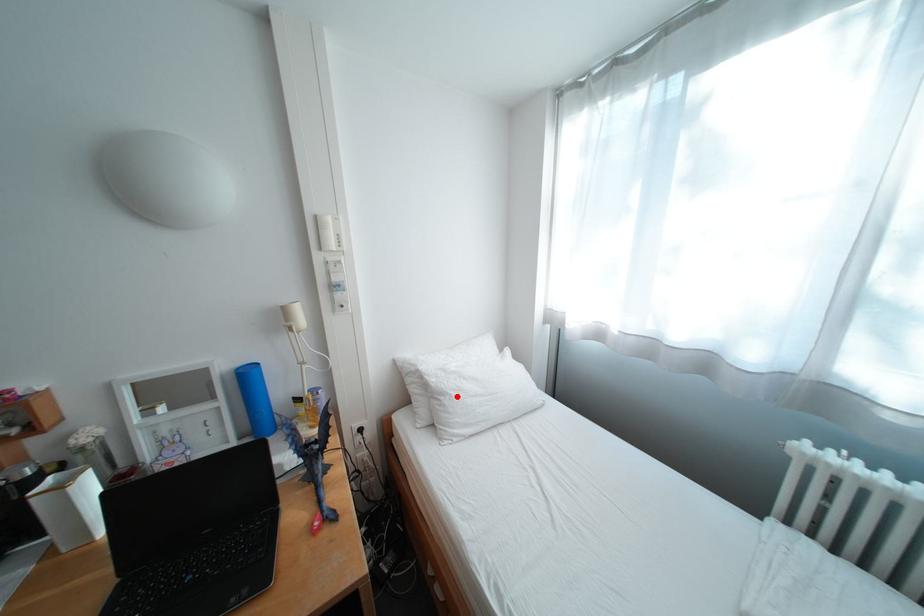
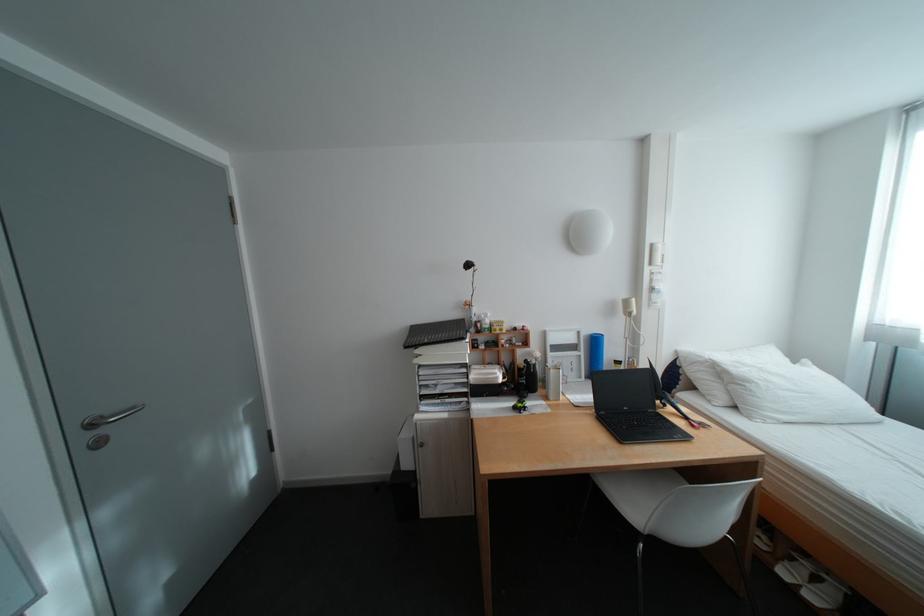
In the second image, find the point that corresponds to the highlighted location in the first image.

(761, 384)